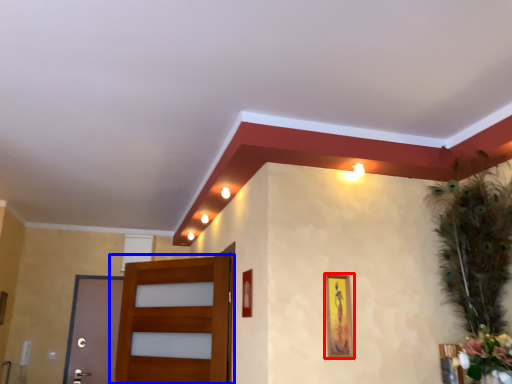
Question: Which object appears closest to the camera in this image, picture frame (highlighted by a red box) or door (highlighted by a blue box)?

Choices:
 (A) picture frame
 (B) door

Answer: (A)